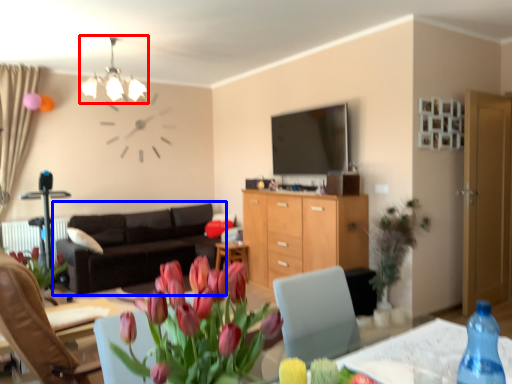
Question: Which of the following is the closest to the observer, light fixture (highlighted by a red box) or studio couch (highlighted by a blue box)?

Choices:
 (A) light fixture
 (B) studio couch

Answer: (A)